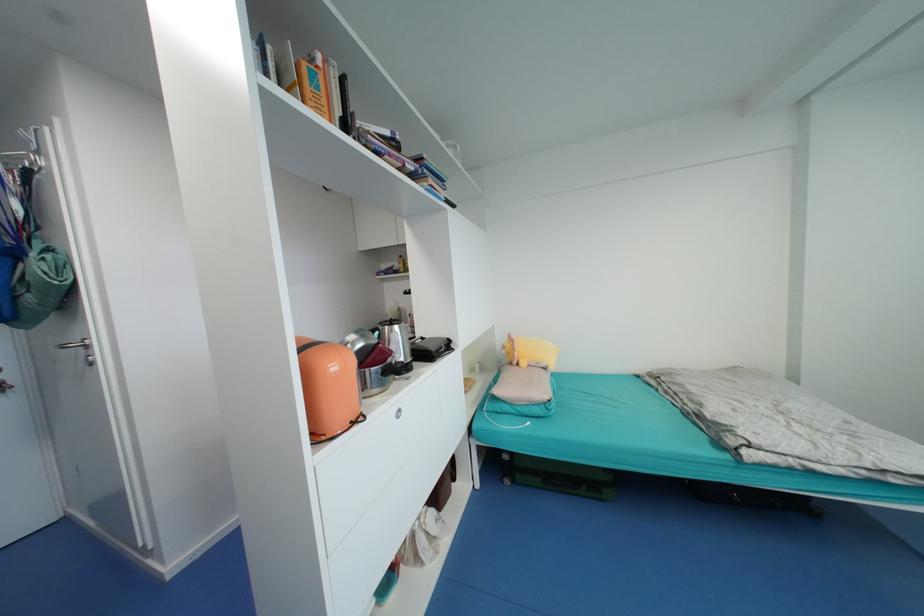
Which object does [523,384] point to?

It corresponds to the beige pillow in the image.